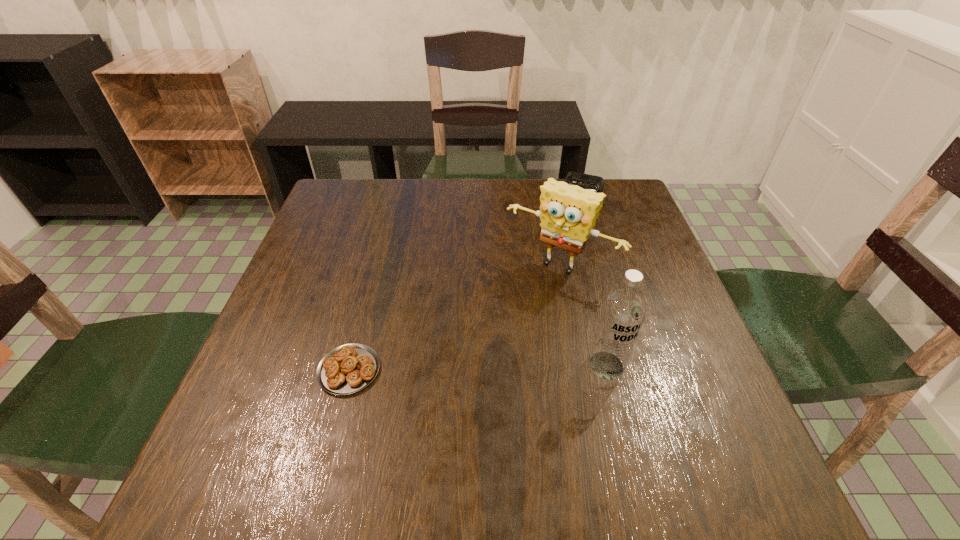
Locate an element on the screen. free space on the desktop that is between the leftmost object and the vodka and is positioned on the display of the alarm clock is located at coordinates (511, 367).

You are a GUI agent. You are given a task and a screenshot of the screen. Output one action in this format:
    pyautogui.click(x=<x>, y=<y>)
    Task: Click on the vacant space on the desktop that is between the leftmost object and the vodka and is positioned on the face of the sponge
    
    Given the screenshot: What is the action you would take?
    pyautogui.click(x=487, y=368)